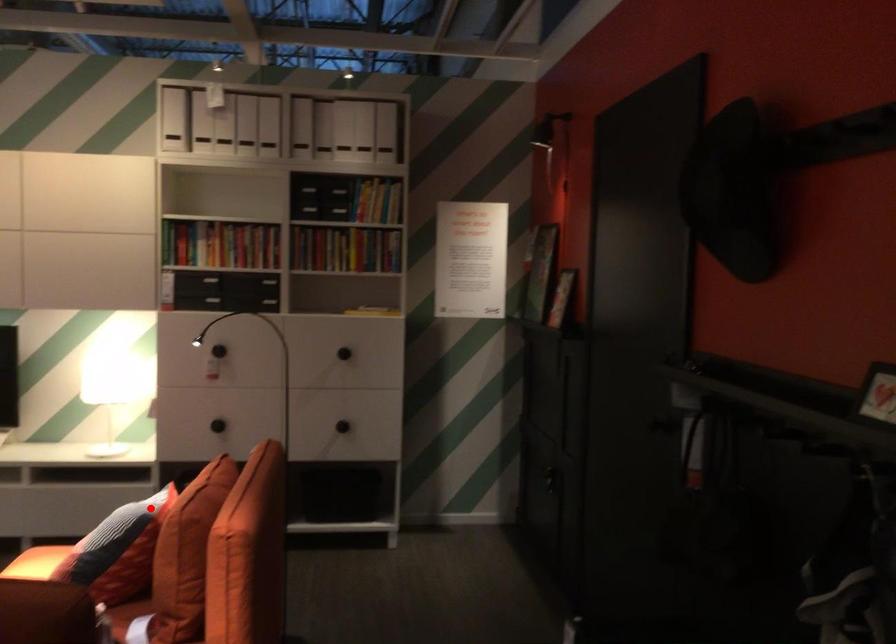
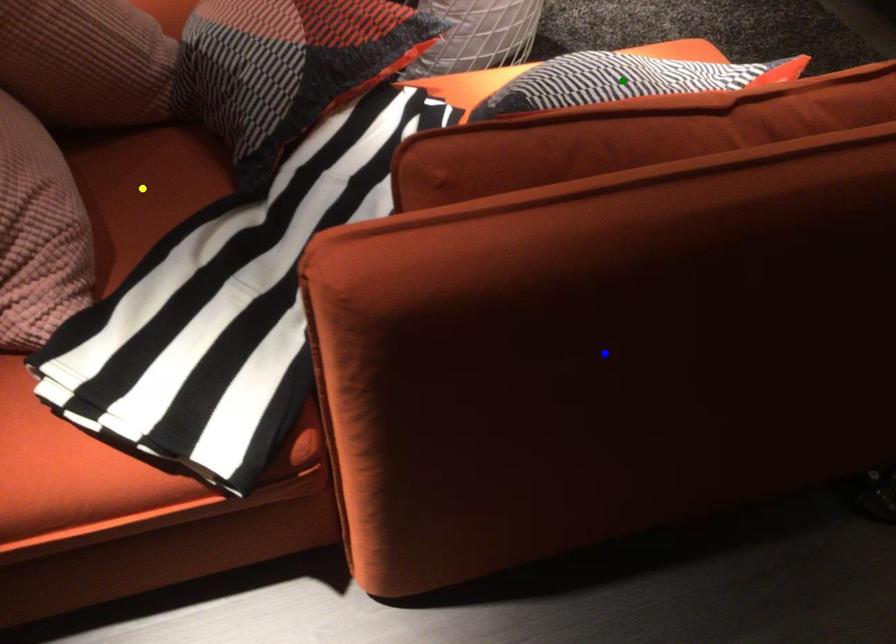
Question: I am providing you with two images of the same scene from different viewpoints. A red point is marked on the first image. You are given multiple points on the second image. Which spot in image 2 lines up with the point in image 1?

Choices:
 (A) yellow point
 (B) blue point
 (C) green point

Answer: (C)